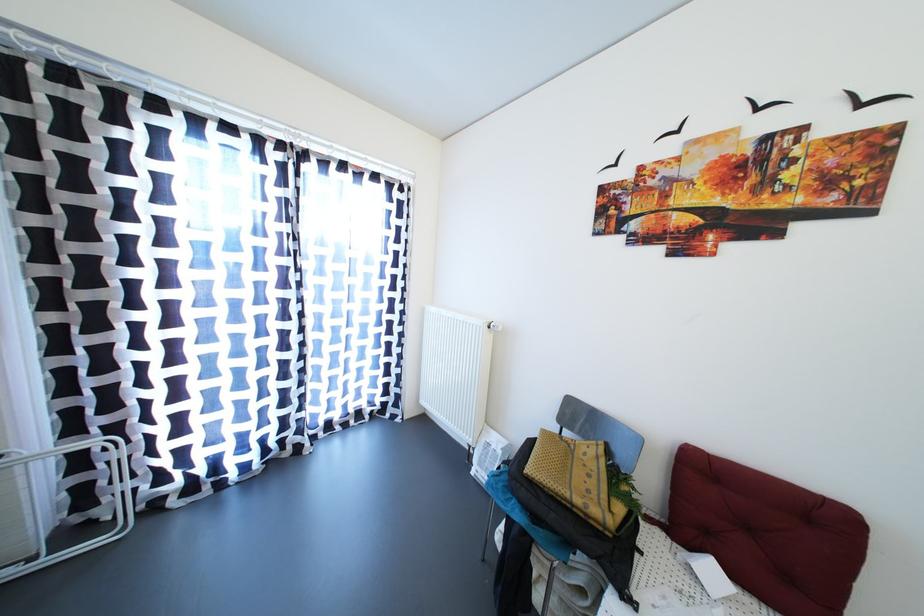
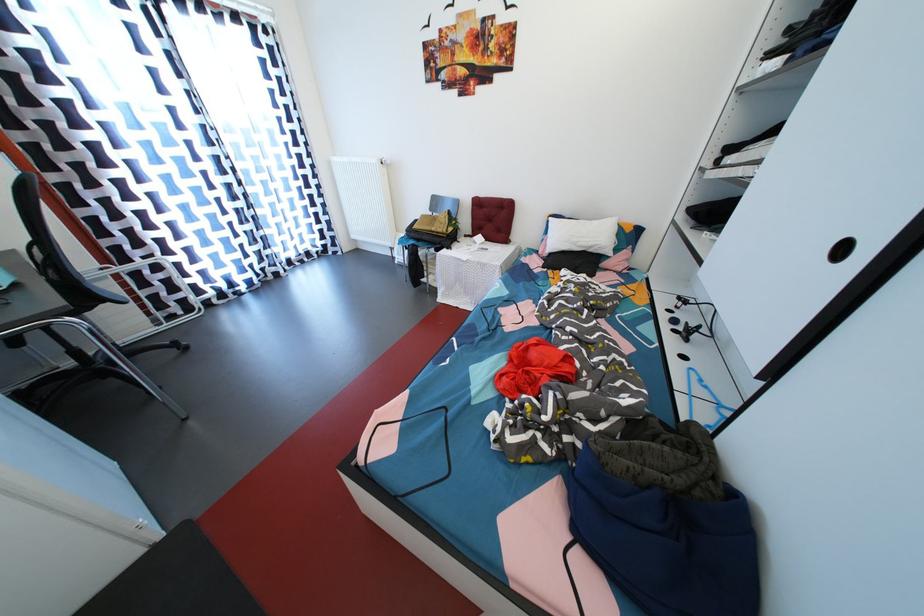
Where in the second image is the point corresponding to [677,525] from the first image?

(479, 237)